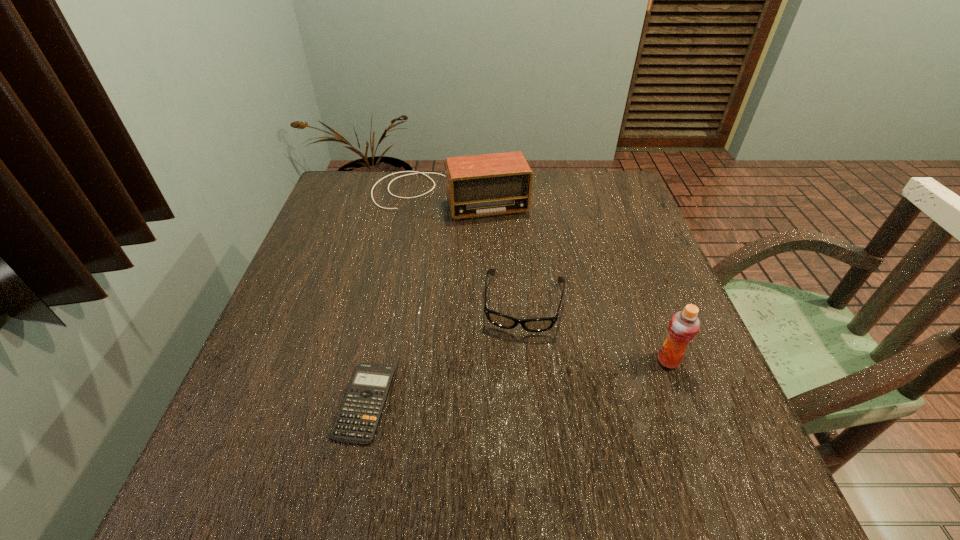
Image resolution: width=960 pixels, height=540 pixels. I want to click on free space between the spectacles and the rightmost object, so click(596, 331).

At what (x,y) coordinates should I click in order to perform the action: click on free spot between the shortest object and the third nearest object. Please return your answer as a coordinate pair (x, y). Looking at the image, I should click on (444, 352).

This screenshot has height=540, width=960. Find the location of `vacant space that's between the orange juice and the shortest object`. vacant space that's between the orange juice and the shortest object is located at coordinates point(516,381).

Select which object is the closest to the spectacles. Please provide its 2D coordinates. Your answer should be formatted as a tuple, i.e. [(x, y)], where the tuple contains the x and y coordinates of a point satisfying the conditions above.

[(684, 325)]

Select which object appears as the third closest to the spectacles. Please provide its 2D coordinates. Your answer should be formatted as a tuple, i.e. [(x, y)], where the tuple contains the x and y coordinates of a point satisfying the conditions above.

[(491, 184)]

Identify the location of vacant area in the image that satisfies the following two spatial constraints: 1. on the front side of the rightmost object; 2. on the left side of the farthest object. The width and height of the screenshot is (960, 540). (433, 361).

Identify the location of free spot that satisfies the following two spatial constraints: 1. on the front side of the farthest object; 2. on the left side of the rightmost object. This screenshot has height=540, width=960. (433, 361).

This screenshot has width=960, height=540. In order to click on blank space that satisfies the following two spatial constraints: 1. on the front side of the third nearest object; 2. on the left side of the radio receiver in this screenshot , I will do `click(439, 302)`.

This screenshot has width=960, height=540. What are the coordinates of `vacant space that satisfies the following two spatial constraints: 1. on the front side of the farthest object; 2. on the right side of the second shortest object` in the screenshot? It's located at (439, 302).

This screenshot has height=540, width=960. In order to click on blank area in the image that satisfies the following two spatial constraints: 1. on the back side of the rightmost object; 2. on the left side of the shortest object in this screenshot , I will do `click(374, 361)`.